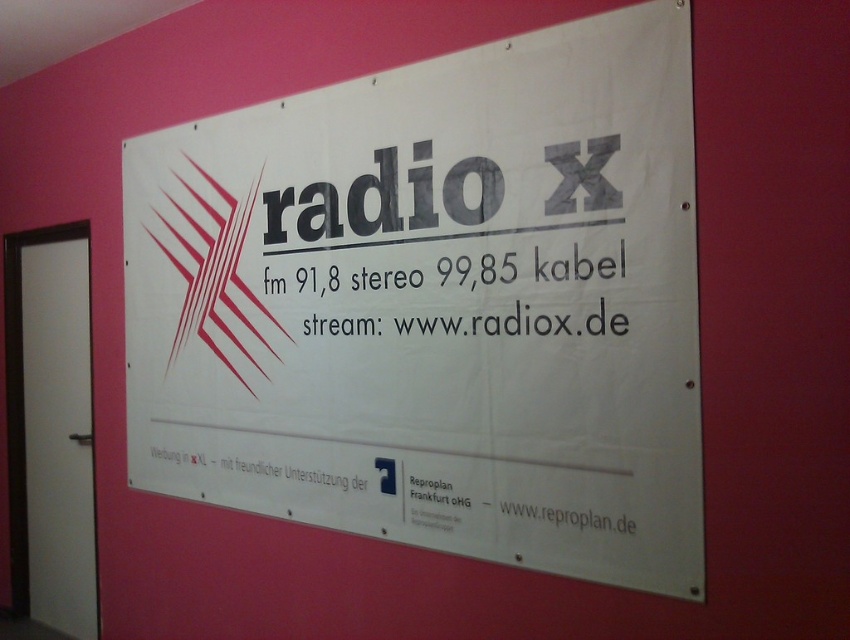
You are trying to read the text on the white paper poster at center and the white paper text at center. Which one is more visible to you?

The white paper poster at center is more visible because it is in front of the white paper text at center, making it easier to see.

In the scene shown: You are designing a new layout for a radio station poster and want to ensure that the white text at center is visible against the white paper poster at center. What adjustment would you make to improve visibility?

Since the white paper poster at center is larger than the white text at center, you should consider changing the text color to a contrasting shade like black or dark blue to ensure it stands out against the white background.

You are designing a layout for a radio station poster. You have a white paper poster at center and a white paper text at center. Which object will occupy more space on the wall?

The white paper poster at center has a larger size compared to the white paper text at center, so it will occupy more space on the wall.